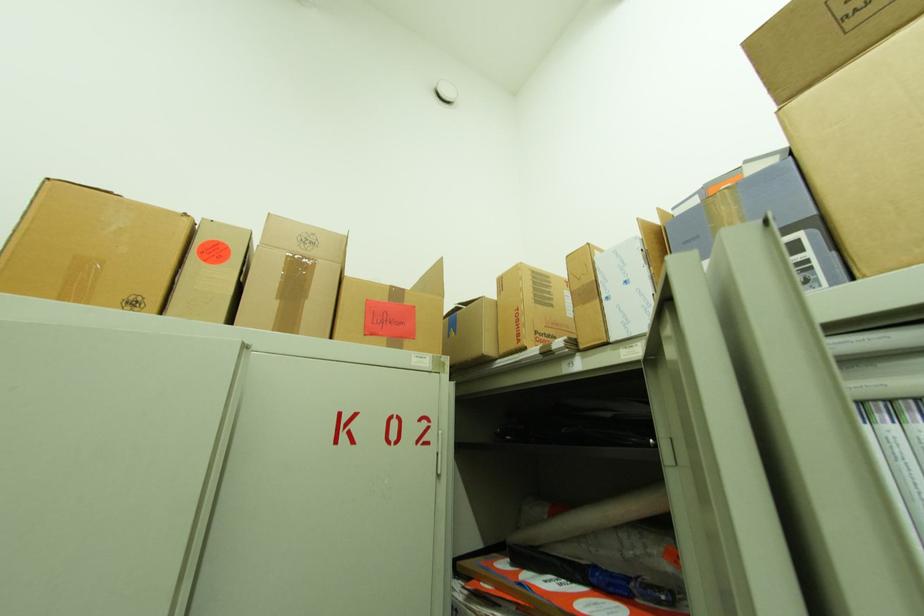
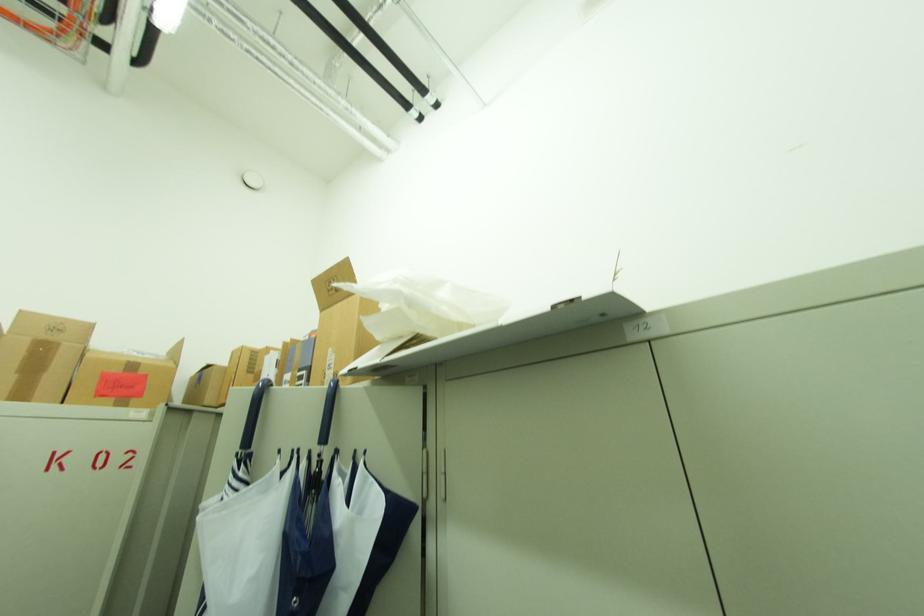
Which direction would the cameraman need to move to produce the second image?

The cameraman walked toward right, backward.